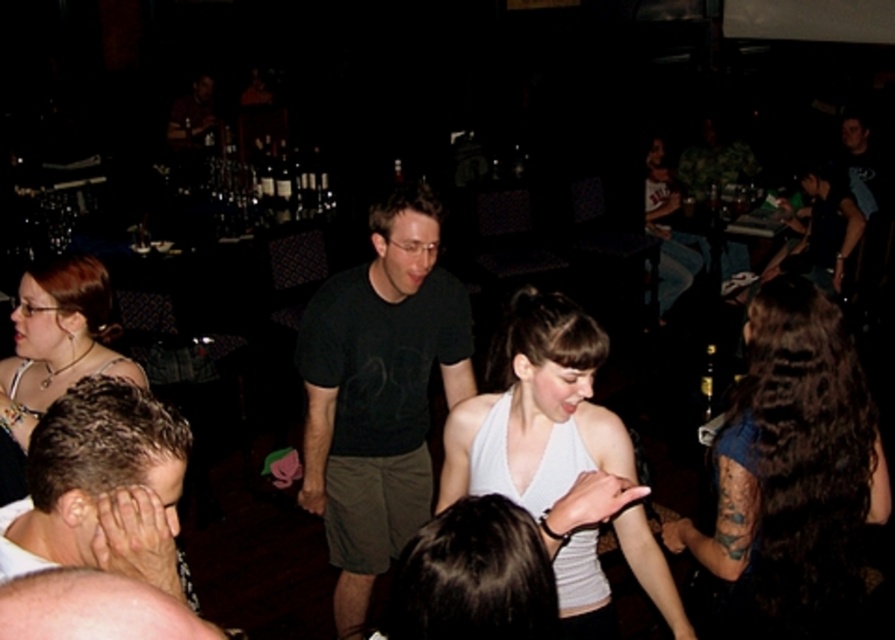
Does white matte tank top at center appear on the right side of smooth skin head at lower left?

Indeed, white matte tank top at center is positioned on the right side of smooth skin head at lower left.

Is white matte tank top at center closer to camera compared to smooth skin head at lower left?

No, white matte tank top at center is behind smooth skin head at lower left.

Who is more forward, (530, 442) or (48, 596)?

Point (48, 596) is more forward.

Identify the location of white matte tank top at center. This screenshot has height=640, width=895. (535, 410).

Does dark brown hair at lower right appear on the right side of smooth skin head at lower left?

Yes, dark brown hair at lower right is to the right of smooth skin head at lower left.

Who is taller, dark brown hair at lower right or smooth skin head at lower left?

With more height is dark brown hair at lower right.

This screenshot has height=640, width=895. What do you see at coordinates (791, 472) in the screenshot? I see `dark brown hair at lower right` at bounding box center [791, 472].

Find the location of `dark brown hair at lower right`. dark brown hair at lower right is located at coordinates (791, 472).

Is white matte hair at lower left further to camera compared to smooth skin head at lower left?

Yes.

Find the location of `white matte hair at lower left`. white matte hair at lower left is located at coordinates (100, 486).

Where is `white matte hair at lower left`? This screenshot has height=640, width=895. white matte hair at lower left is located at coordinates 100,486.